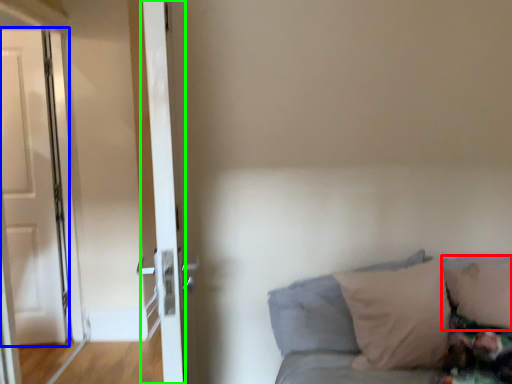
Question: Which object is the closest to the pillow (highlighted by a red box)? Choose among these: door (highlighted by a blue box) or door (highlighted by a green box).

Choices:
 (A) door
 (B) door

Answer: (B)